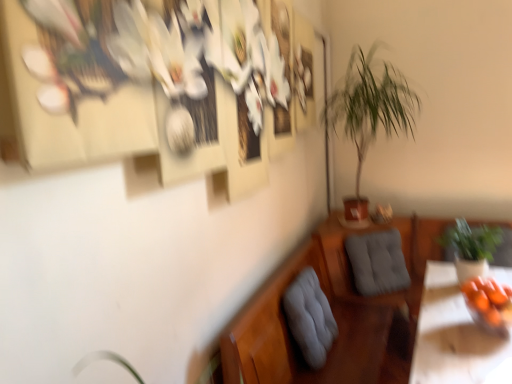
Question: Is green leafy plant at center-right, which appears as the 1th houseplant when viewed from the left, aimed at green leafy plant at right, marked as the 1th houseplant in a right-to-left arrangement?

Choices:
 (A) yes
 (B) no

Answer: (B)

Question: Is the depth of green leafy plant at center-right, which appears as the 1th houseplant when viewed from the top, less than that of green leafy plant at right, the second houseplant from the left?

Choices:
 (A) yes
 (B) no

Answer: (A)

Question: Can you confirm if green leafy plant at center-right, which is the second houseplant from right to left, is smaller than green leafy plant at right, marked as the 1th houseplant in a right-to-left arrangement?

Choices:
 (A) yes
 (B) no

Answer: (B)

Question: Is green leafy plant at center-right, which appears as the 1th houseplant when viewed from the top, facing away from green leafy plant at right, the 1th houseplant when ordered from bottom to top?

Choices:
 (A) no
 (B) yes

Answer: (A)

Question: Considering the relative sizes of green leafy plant at center-right, which appears as the 1th houseplant when viewed from the top, and green leafy plant at right, the 1th houseplant when ordered from bottom to top, in the image provided, is green leafy plant at center-right, which appears as the 1th houseplant when viewed from the top, wider than green leafy plant at right, the 1th houseplant when ordered from bottom to top,?

Choices:
 (A) yes
 (B) no

Answer: (A)

Question: Which is correct: green leafy plant at right, the second houseplant from the left, is inside green leafy plant at center-right, which appears as the 1th houseplant when viewed from the left, or outside of it?

Choices:
 (A) inside
 (B) outside

Answer: (B)

Question: From the image's perspective, is green leafy plant at right, the second houseplant from the left, located above or below green leafy plant at center-right, which appears as the 1th houseplant when viewed from the left?

Choices:
 (A) below
 (B) above

Answer: (A)

Question: Considering the positions of green leafy plant at right, which ranks as the second houseplant in top-to-bottom order, and green leafy plant at center-right, which appears as the 1th houseplant when viewed from the top, in the image, is green leafy plant at right, which ranks as the second houseplant in top-to-bottom order, wider or thinner than green leafy plant at center-right, which appears as the 1th houseplant when viewed from the top,?

Choices:
 (A) wide
 (B) thin

Answer: (B)

Question: In the image, is green leafy plant at right, the second houseplant from the left, on the left side or the right side of green leafy plant at center-right, arranged as the 2th houseplant when ordered from the bottom?

Choices:
 (A) right
 (B) left

Answer: (A)

Question: Would you say orange matte bowl at lower right is to the left or to the right of gray fabric cushion at lower center, arranged as the second swivel chair when viewed from the right, in the picture?

Choices:
 (A) left
 (B) right

Answer: (B)

Question: From the image's perspective, relative to gray fabric cushion at lower center, the 1th swivel chair in the left-to-right sequence, is orange matte bowl at lower right above or below?

Choices:
 (A) below
 (B) above

Answer: (B)

Question: Based on their sizes in the image, would you say orange matte bowl at lower right is bigger or smaller than gray fabric cushion at lower center, arranged as the second swivel chair when viewed from the right?

Choices:
 (A) big
 (B) small

Answer: (B)

Question: Looking at their shapes, would you say orange matte bowl at lower right is wider or thinner than gray fabric cushion at lower center, which is the 1th swivel chair in front-to-back order?

Choices:
 (A) wide
 (B) thin

Answer: (A)

Question: Is green leafy plant at center-right, arranged as the 2th houseplant when ordered from the bottom, to the left or to the right of gray fabric cushion at lower center, which is the 1th swivel chair in front-to-back order, in the image?

Choices:
 (A) left
 (B) right

Answer: (B)

Question: In the image, is green leafy plant at center-right, arranged as the 2th houseplant when ordered from the bottom, positioned in front of or behind gray fabric cushion at lower center, which ranks as the second swivel chair in back-to-front order?

Choices:
 (A) front
 (B) behind

Answer: (B)